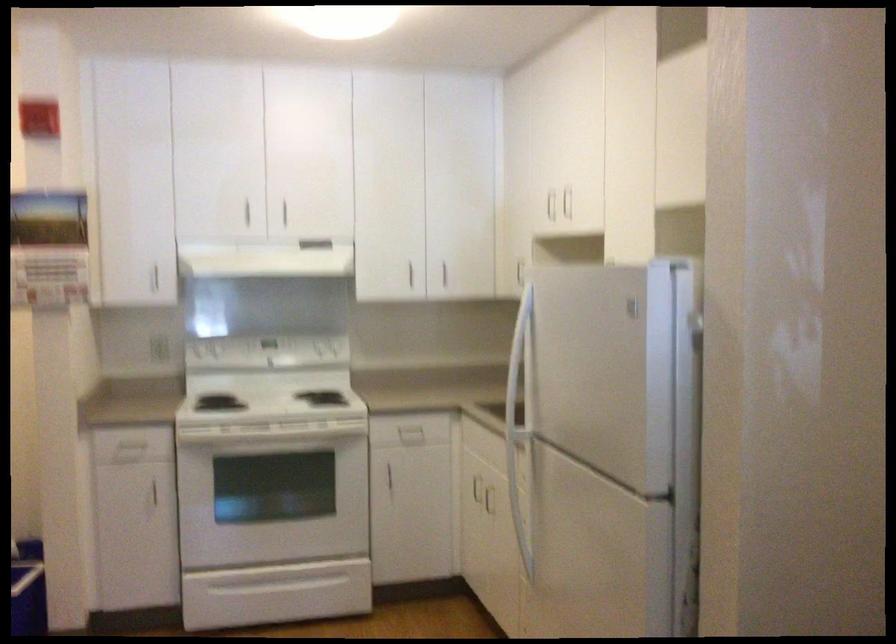
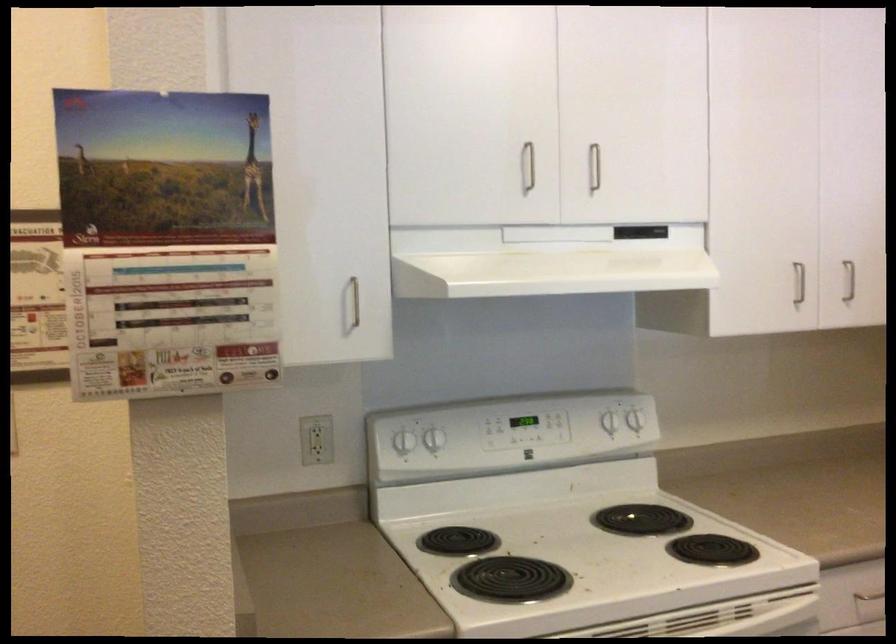
Find the pixel in the second image that matches pixel 444 270 in the first image.

(849, 281)